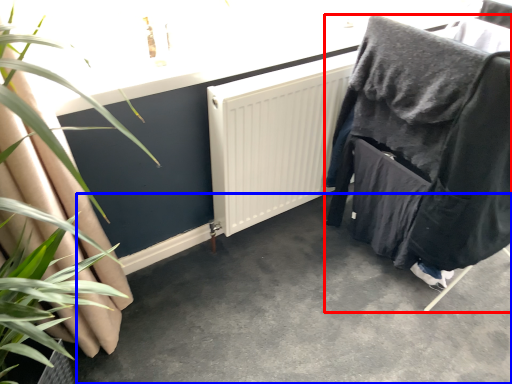
Question: Among these objects, which one is farthest to the camera, furniture (highlighted by a red box) or concrete (highlighted by a blue box)?

Choices:
 (A) furniture
 (B) concrete

Answer: (A)